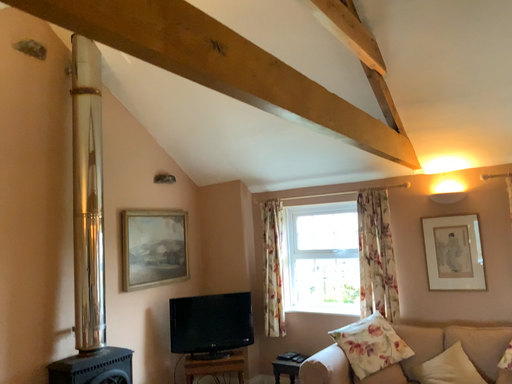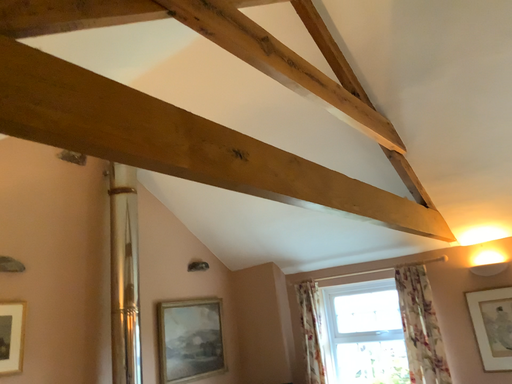
Question: How did the camera likely rotate when shooting the video?

Choices:
 (A) rotated upward
 (B) rotated downward

Answer: (A)